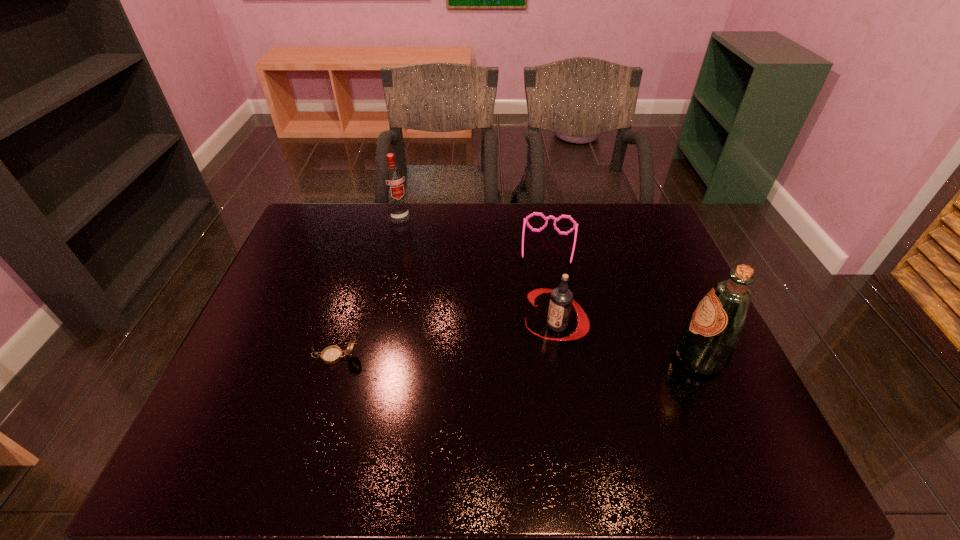
Find the location of a particular element. compass is located at coordinates (332, 354).

The width and height of the screenshot is (960, 540). Find the location of `the tallest object`. the tallest object is located at coordinates coord(706,344).

What are the coordinates of `olive oil` in the screenshot? It's located at (706, 344).

You are a GUI agent. You are given a task and a screenshot of the screen. Output one action in this format:
    pyautogui.click(x=<x>, y=<y>)
    Task: Click on the spectacles
    Image resolution: width=960 pixels, height=540 pixels.
    Given the screenshot: What is the action you would take?
    pyautogui.click(x=575, y=227)

In order to click on the third tallest object in this screenshot , I will do `click(561, 300)`.

You are a GUI agent. You are given a task and a screenshot of the screen. Output one action in this format:
    pyautogui.click(x=<x>, y=<y>)
    Task: Click on the fourth shortest object
    This screenshot has width=960, height=540.
    Given the screenshot: What is the action you would take?
    pyautogui.click(x=393, y=178)

Find the location of `the farthest object`. the farthest object is located at coordinates (393, 178).

The height and width of the screenshot is (540, 960). I want to click on vacant space located 0.190m on the face of the compass, so click(x=236, y=356).

What are the coordinates of `free region located 0.280m on the front-facing side of the rightmost object` in the screenshot? It's located at (x=560, y=358).

Locate an element on the screen. The width and height of the screenshot is (960, 540). vacant region located 0.100m on the front-facing side of the rightmost object is located at coordinates (633, 358).